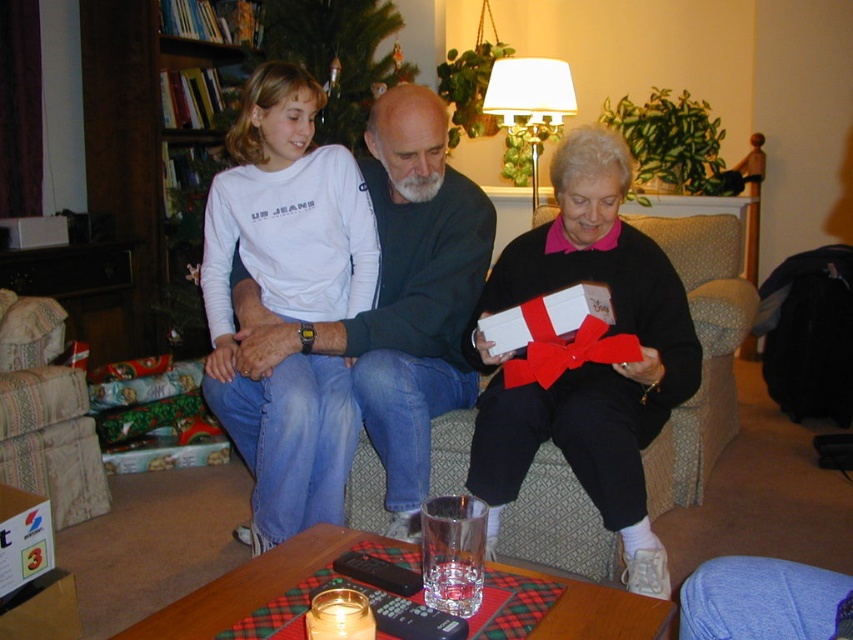
Does matte white gift box at center appear over patterned fabric armchair at lower left?

Correct, matte white gift box at center is located above patterned fabric armchair at lower left.

Does matte white gift box at center come in front of patterned fabric armchair at lower left?

Yes, matte white gift box at center is in front of patterned fabric armchair at lower left.

Between point (531, 400) and point (27, 314), which one is positioned behind?

The point (27, 314) is behind.

The image size is (853, 640). In order to click on matte white gift box at center in this screenshot , I will do `click(500, 308)`.

Which is in front, point (384, 221) or point (734, 612)?

Positioned in front is point (734, 612).

This screenshot has height=640, width=853. I want to click on matte white gift box at center, so click(x=500, y=308).

Where is `matte white gift box at center`? matte white gift box at center is located at coordinates (500, 308).

Which is more to the right, dark gray sweater at center or patterned fabric armchair at lower left?

Positioned to the right is dark gray sweater at center.

Is point (466, 305) positioned behind point (0, 388)?

That is False.

I want to click on dark gray sweater at center, so click(398, 298).